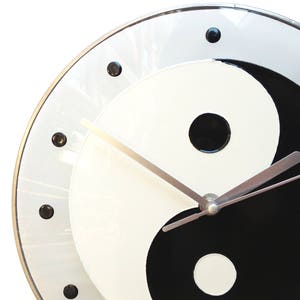
Find the location of a particular element. The image size is (300, 300). silver/gold rim around clock is located at coordinates (15, 185).